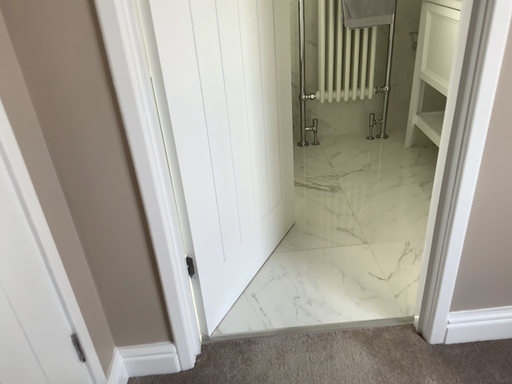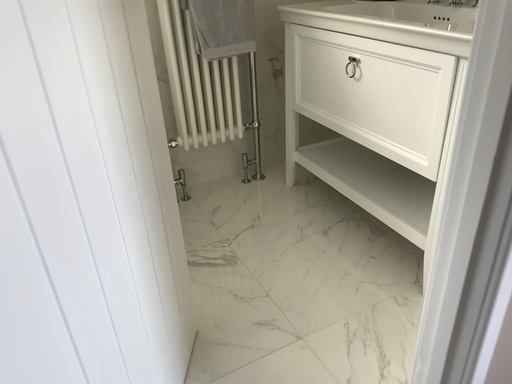
Question: Which way did the camera rotate in the video?

Choices:
 (A) rotated left
 (B) rotated right

Answer: (B)